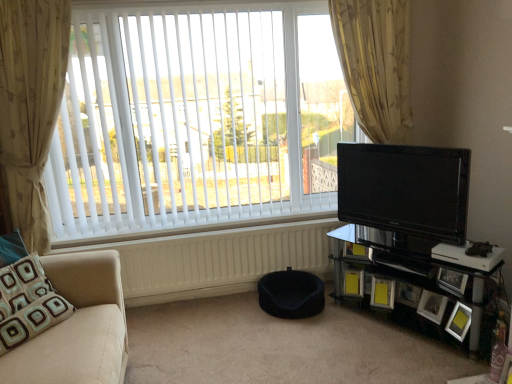
Question: Looking at the image, does white matte radiator at lower center seem bigger or smaller compared to matte black picture frame at lower right, placed as the fourth picture frame when sorted from right to left?

Choices:
 (A) big
 (B) small

Answer: (A)

Question: From the image's perspective, relative to matte black picture frame at lower right, which appears as the third picture frame when viewed from the left, is white matte radiator at lower center above or below?

Choices:
 (A) above
 (B) below

Answer: (A)

Question: Estimate the real-world distances between objects in this image. Which object is closer to the black fabric bean bag at center?

Choices:
 (A) beige fabric studio couch at left
 (B) yellow matte picture frame at lower right, which is the 6th picture frame from right to left
 (C) gold floral fabric curtain at upper right, positioned as the second curtain in left-to-right order
 (D) matte black picture frame at lower right, placed as the fourth picture frame when sorted from right to left
 (E) black glass entertainment center at lower right

Answer: (B)

Question: Which is nearer to the black fabric pet bed at lower center?

Choices:
 (A) teal fabric pillow at lower left
 (B) black glass entertainment center at lower right
 (C) yellow matte picture frame at lower right, which is the 6th picture frame from right to left
 (D) white matte radiator at lower center
 (E) beige fabric studio couch at left

Answer: (D)